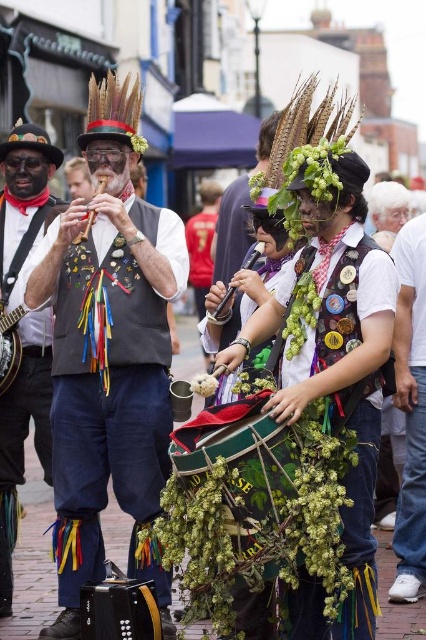
Question: Does matte black vest at center lie in front of brushed metal flute at upper left?

Choices:
 (A) no
 (B) yes

Answer: (B)

Question: Which point is closer to the camera?

Choices:
 (A) (77, 484)
 (B) (103, 189)
 (C) (5, 378)
 (D) (259, 246)

Answer: (A)

Question: Which point appears farthest from the camera in this image?

Choices:
 (A) (101, 442)
 (B) (97, 189)
 (C) (250, 268)

Answer: (C)

Question: Which of the following is the closest to the observer?

Choices:
 (A) (66, 384)
 (B) (48, 360)
 (C) (9, 328)
 (D) (83, 234)

Answer: (D)

Question: Is matte black banjo at left smaller than metallic accordion at left?

Choices:
 (A) yes
 (B) no

Answer: (B)

Question: Is matte black vest at center thinner than wooden flute at center?

Choices:
 (A) yes
 (B) no

Answer: (B)